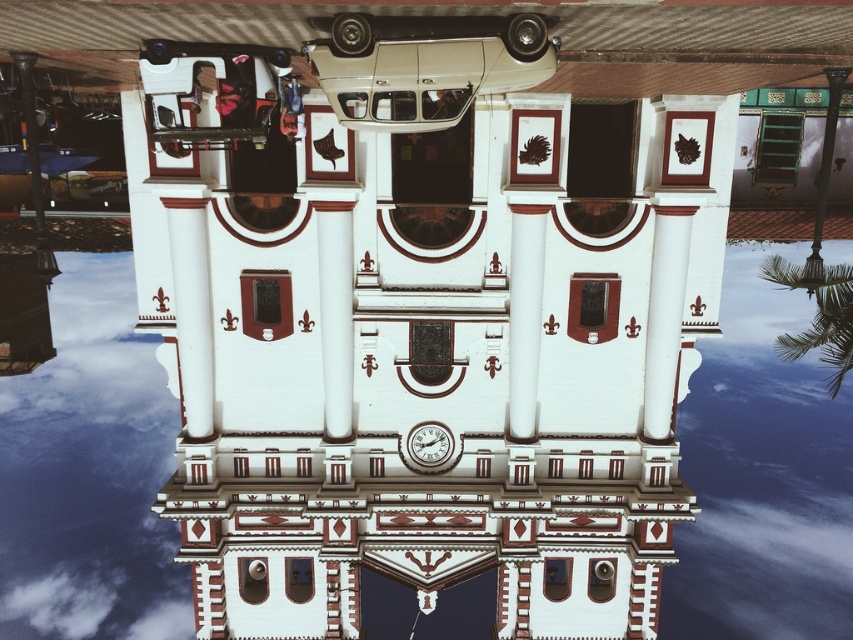
Question: Can you confirm if white glossy column at center is thinner than metallic gold clock at center?

Choices:
 (A) no
 (B) yes

Answer: (B)

Question: Which object is the farthest from the transparent glass water at center?

Choices:
 (A) white glossy column at center
 (B) metallic gold clock at center

Answer: (A)

Question: Does white glossy column at center have a smaller size compared to metallic gold clock at center?

Choices:
 (A) yes
 (B) no

Answer: (B)

Question: Considering the real-world distances, which object is farthest from the white glossy column at center?

Choices:
 (A) transparent glass water at center
 (B) metallic gold clock at center

Answer: (A)

Question: Which of the following is the closest to the observer?

Choices:
 (A) metallic gold clock at center
 (B) white glossy column at center
 (C) transparent glass water at center

Answer: (B)

Question: Can you confirm if transparent glass water at center is positioned to the right of white glossy column at center?

Choices:
 (A) no
 (B) yes

Answer: (A)